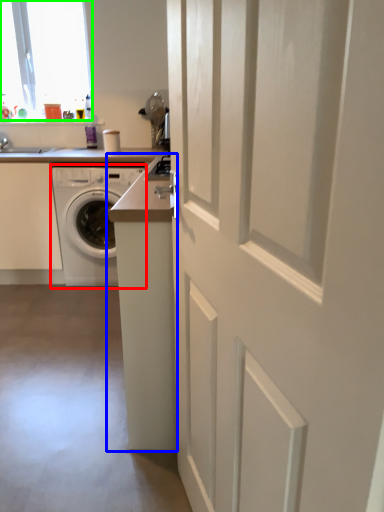
Question: Estimate the real-world distances between objects in this image. Which object is farther from washing machine (highlighted by a red box), counter (highlighted by a blue box) or window (highlighted by a green box)?

Choices:
 (A) counter
 (B) window

Answer: (A)